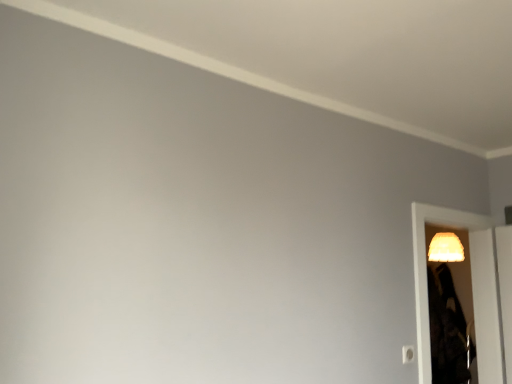
Question: From a real-world perspective, is white plastic light switch at lower right located beneath translucent plastic screen door at right?

Choices:
 (A) yes
 (B) no

Answer: (A)

Question: Does white plastic light switch at lower right have a lesser width compared to translucent plastic screen door at right?

Choices:
 (A) yes
 (B) no

Answer: (A)

Question: Considering the relative sizes of white plastic light switch at lower right and translucent plastic screen door at right in the image provided, is white plastic light switch at lower right smaller than translucent plastic screen door at right?

Choices:
 (A) no
 (B) yes

Answer: (B)

Question: Is white plastic light switch at lower right completely or partially outside of translucent plastic screen door at right?

Choices:
 (A) yes
 (B) no

Answer: (A)

Question: Is white plastic light switch at lower right turned away from translucent plastic screen door at right?

Choices:
 (A) no
 (B) yes

Answer: (A)

Question: In terms of width, does white plastic light switch at lower right look wider or thinner when compared to matte yellow lampshade at right?

Choices:
 (A) wide
 (B) thin

Answer: (B)

Question: Is white plastic light switch at lower right situated inside matte yellow lampshade at right or outside?

Choices:
 (A) outside
 (B) inside

Answer: (A)

Question: Is white plastic light switch at lower right to the left or to the right of matte yellow lampshade at right in the image?

Choices:
 (A) left
 (B) right

Answer: (A)

Question: From a real-world perspective, is white plastic light switch at lower right above or below matte yellow lampshade at right?

Choices:
 (A) above
 (B) below

Answer: (B)

Question: Considering the positions of matte yellow lampshade at right and translucent plastic screen door at right in the image, is matte yellow lampshade at right bigger or smaller than translucent plastic screen door at right?

Choices:
 (A) big
 (B) small

Answer: (B)

Question: From their relative heights in the image, would you say matte yellow lampshade at right is taller or shorter than translucent plastic screen door at right?

Choices:
 (A) short
 (B) tall

Answer: (A)

Question: Does point (453, 261) appear closer or farther from the camera than point (496, 369)?

Choices:
 (A) closer
 (B) farther

Answer: (B)

Question: Is matte yellow lampshade at right inside the boundaries of translucent plastic screen door at right, or outside?

Choices:
 (A) inside
 (B) outside

Answer: (B)

Question: In the image, is matte yellow lampshade at right positioned in front of or behind white plastic light switch at lower right?

Choices:
 (A) front
 (B) behind

Answer: (B)

Question: Is point (446, 238) positioned closer to the camera than point (413, 350)?

Choices:
 (A) farther
 (B) closer

Answer: (A)